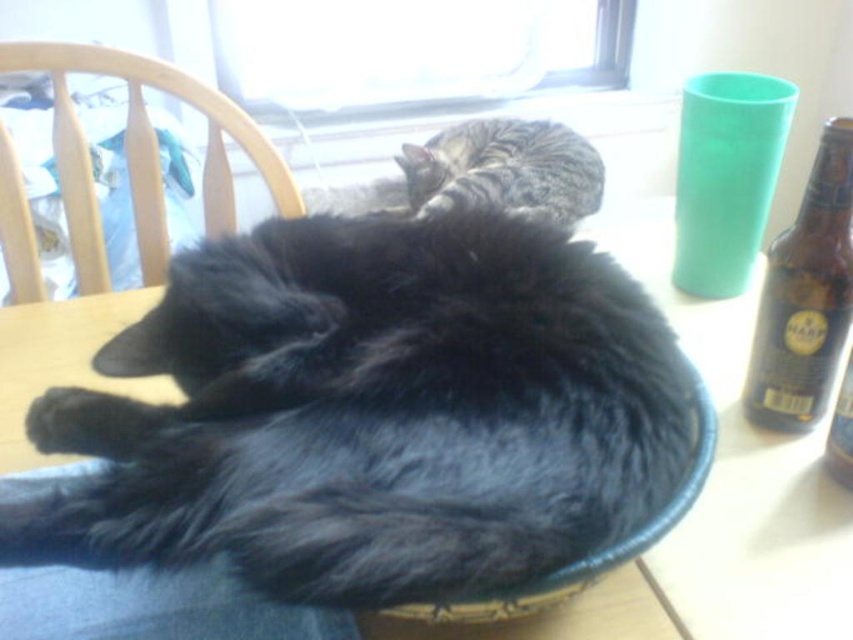
You are organizing a small party and need to place a 15 cm wide centerpiece on the table. Given the wooden chair at upper left and the brown glass bottle at right, which object can you move to make space for the centerpiece without removing the cats?

The brown glass bottle at right can be moved to make space for the centerpiece since it is narrower than the wooden chair at upper left, which is wider and harder to move out of the way.

You are a photographer trying to capture a closeup of the black fluffy cat at center and the brown glass bottle at right. Which object should you focus on first to ensure it appears sharp in the photo?

The black fluffy cat at center is closer to the viewer than the brown glass bottle at right, so you should focus on the black fluffy cat at center first to ensure it appears sharp.